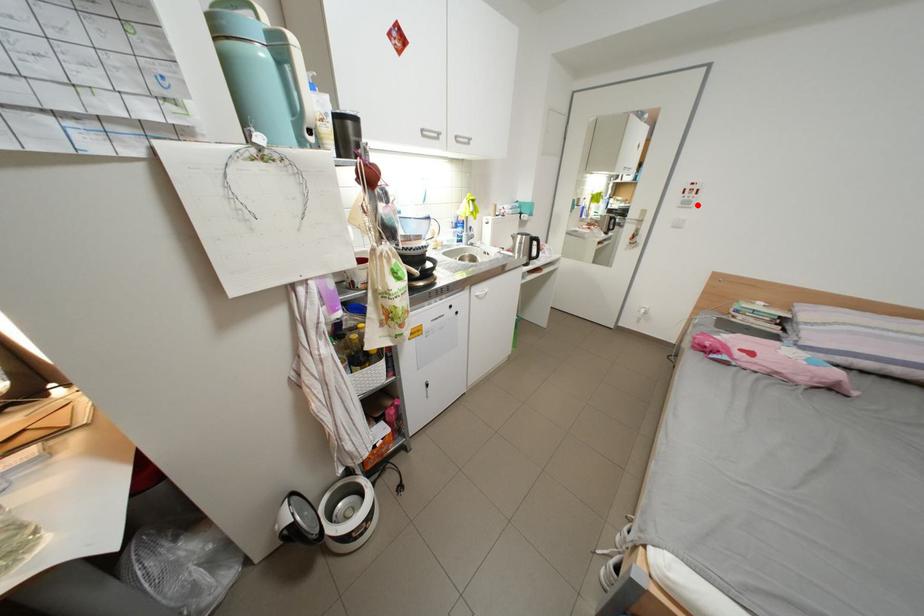
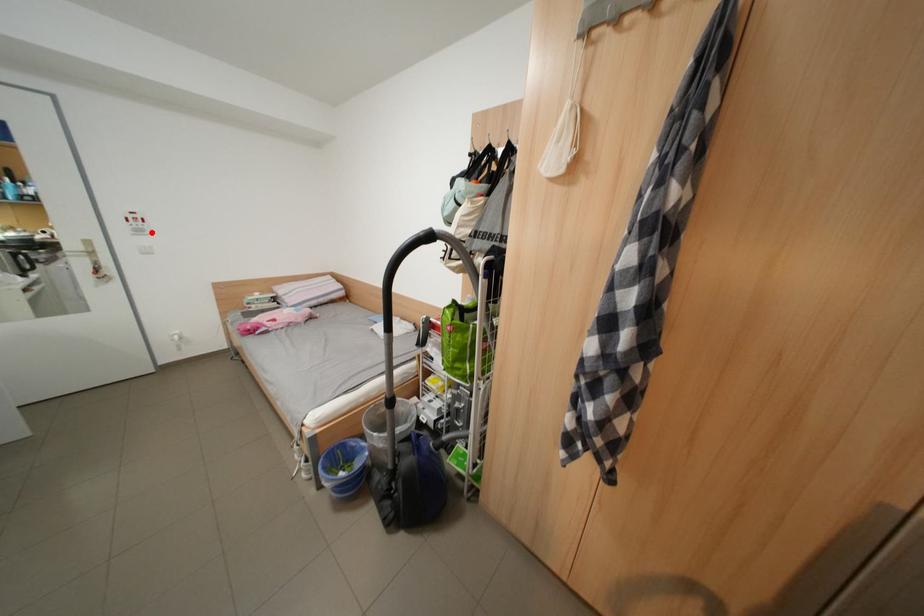
I am providing you with two images of the same scene from different viewpoints. A red point is marked on the first image and another point is marked on the second image. Are the points marked in image1 and image2 representing the same 3D position?

Yes